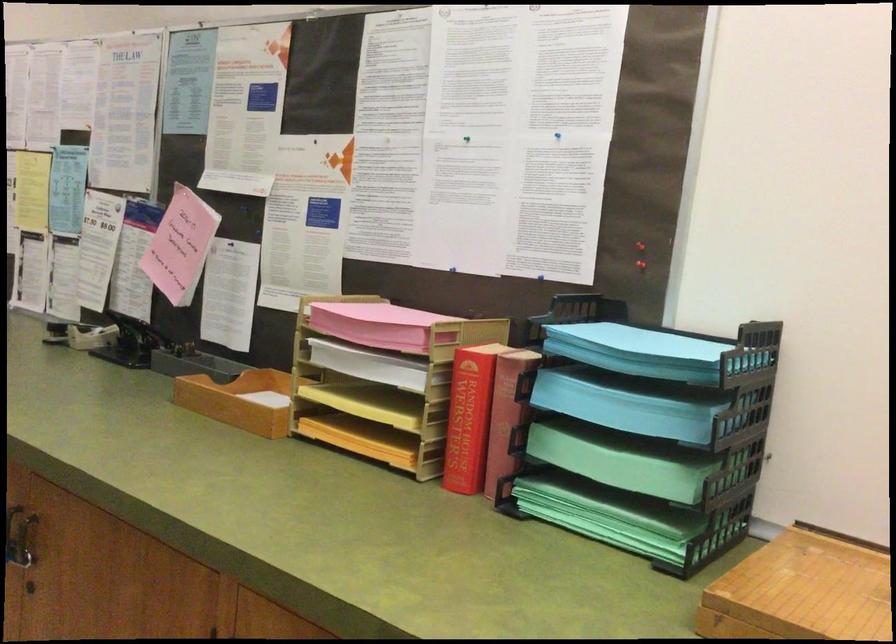
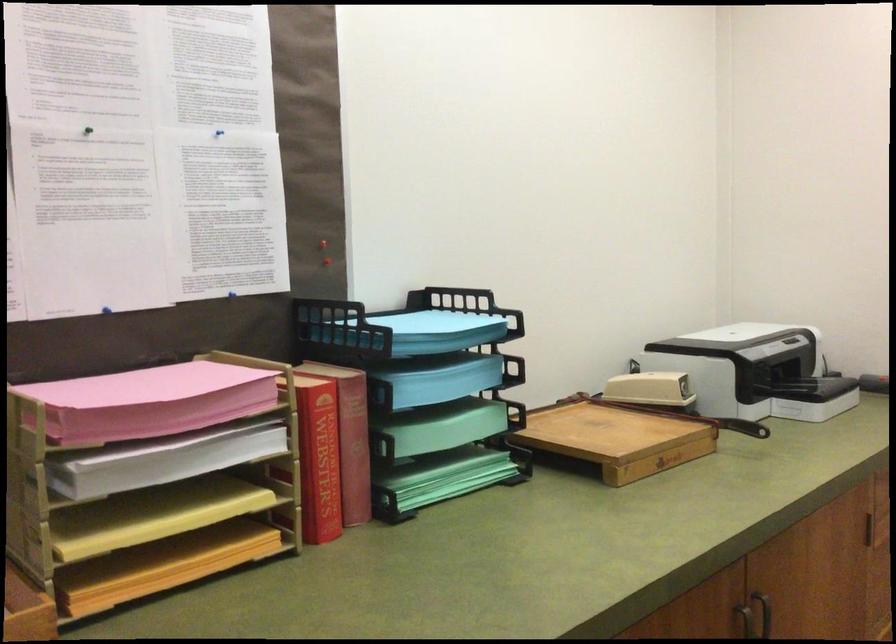
The point at (395, 406) is marked in the first image. Where is the corresponding point in the second image?

(151, 515)